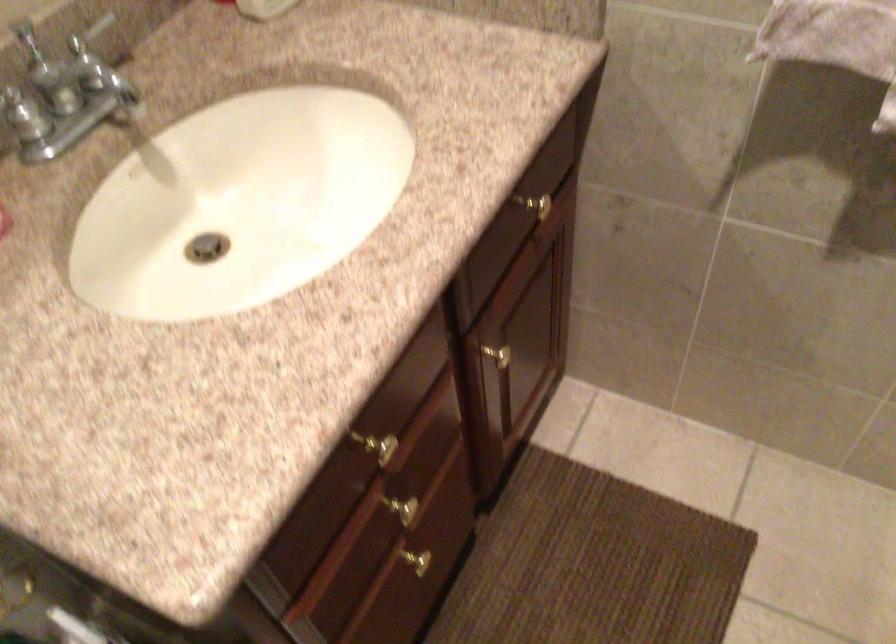
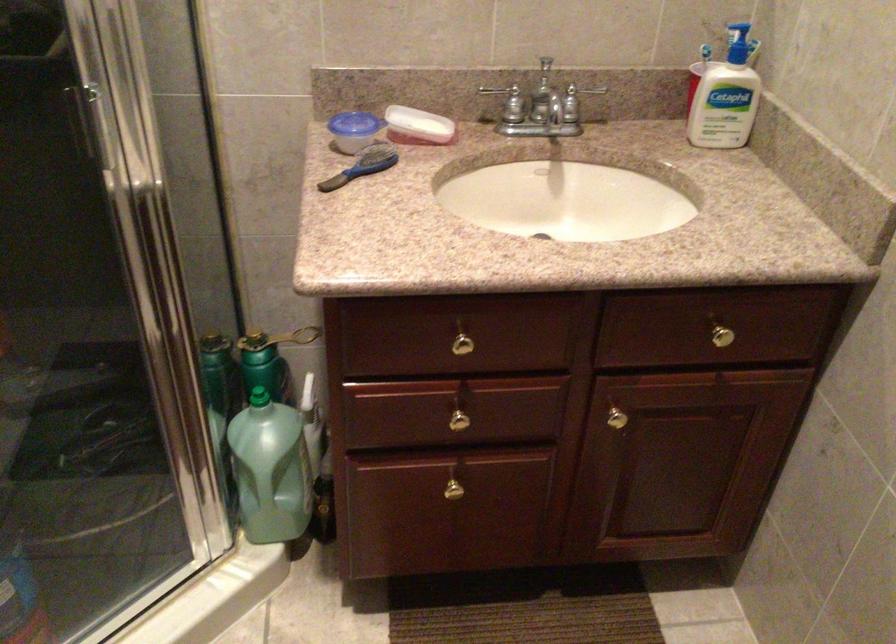
Find the pixel in the second image that matches (388,455) in the first image.

(462, 348)